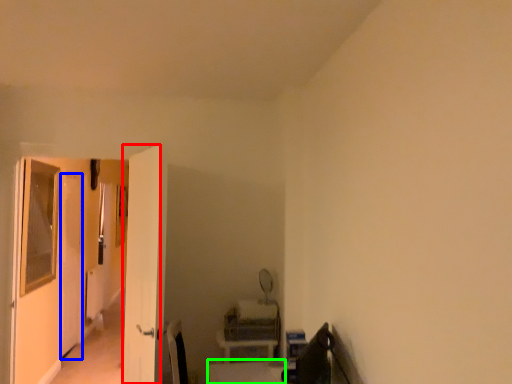
Question: Estimate the real-world distances between objects in this image. Which object is closer to screen door (highlighted by a red box), screen door (highlighted by a blue box) or table (highlighted by a green box)?

Choices:
 (A) screen door
 (B) table

Answer: (B)